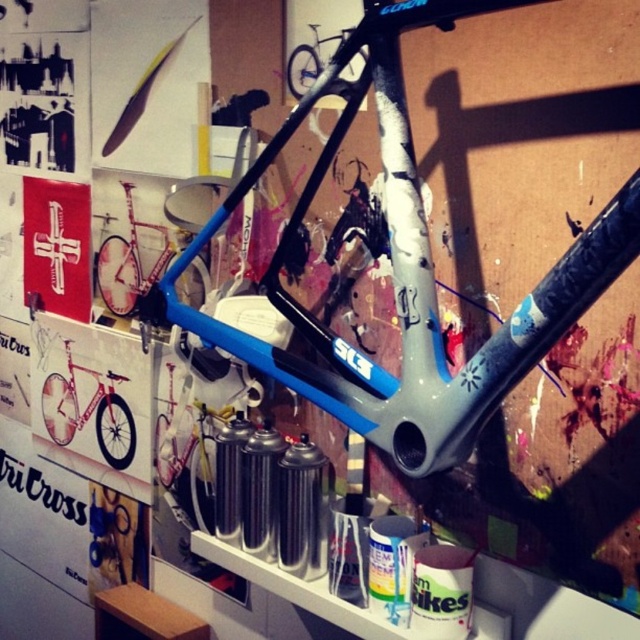
You are examining the bicycle frame and want to determine which of the two points, point (132, 246) or point (364, 61), is closer to you. Based on the scene, which point is nearer?

Point (132, 246) is further to the viewer than point (364, 61). Therefore, point (364, 61) is closer to you.

You are standing in front of the bicycle frame and looking at the two points on the image. Which point is closer to you, point (125, 449) or point (292, 64)?

Point (292, 64) is closer to you because point (125, 449) is behind point (292, 64).

You are an artist planning to paint a mural on the wall behind the shiny red bicycle at left and the matte blue frame at center. You need to know which object is wider to ensure your design accommodates their widths. Which one is wider?

The shiny red bicycle at left might be wider than matte blue frame at center according to the description.